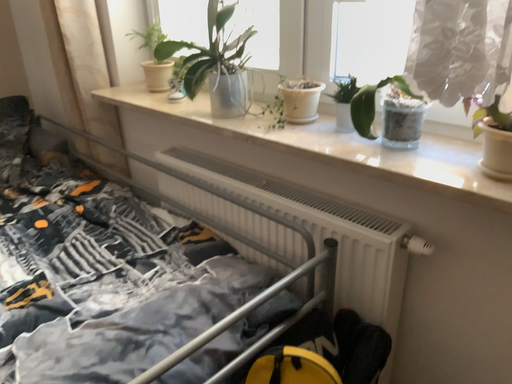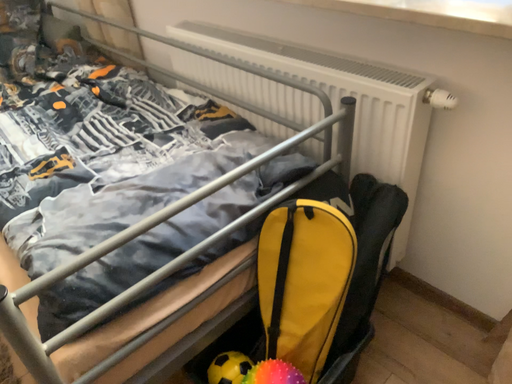
Question: Which way did the camera rotate in the video?

Choices:
 (A) rotated upward
 (B) rotated downward

Answer: (B)